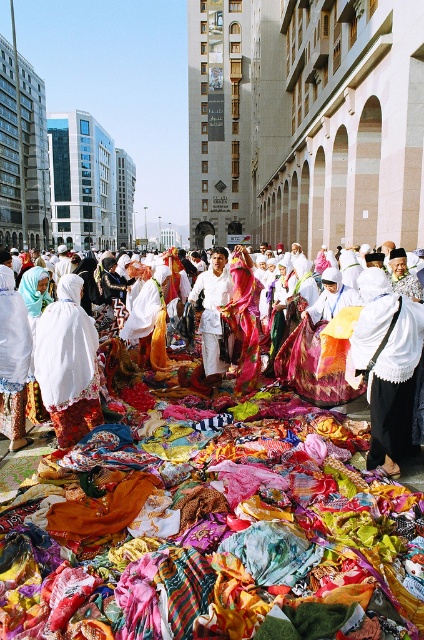
Is white cloth at center positioned behind white fabric dress at center?

Yes, it is behind white fabric dress at center.

Between point (170, 404) and point (41, 381), which one is positioned in front?

Point (41, 381) is in front.

Who is more distant from viewer, (x=178, y=410) or (x=89, y=332)?

Positioned behind is point (x=178, y=410).

Where is `white cloth at center`? The image size is (424, 640). white cloth at center is located at coordinates (253, 432).

Does white fabric dress at center have a lesser width compared to white cotton shirt at center?

No.

Find the location of a particular element. white fabric dress at center is located at coordinates (67, 364).

Between point (323, 372) and point (418, 326), which one is positioned in front?

Point (418, 326) is in front.

Is white cloth at center above white matte cloth at center?

No, white cloth at center is not above white matte cloth at center.

Where is `white cloth at center`? The height and width of the screenshot is (640, 424). white cloth at center is located at coordinates (253, 432).